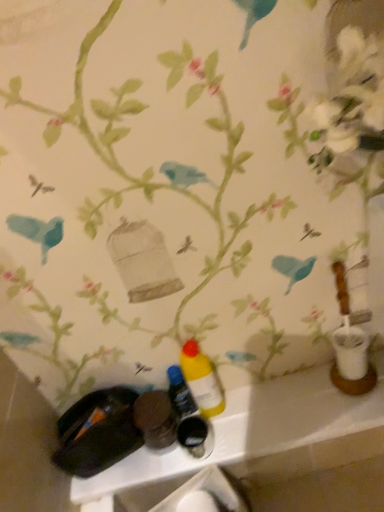
Where is `vacant space to the right of yellow matte bottle at center, which is counted as the 2th bottle, starting from the left`? This screenshot has width=384, height=512. vacant space to the right of yellow matte bottle at center, which is counted as the 2th bottle, starting from the left is located at coordinates (271, 403).